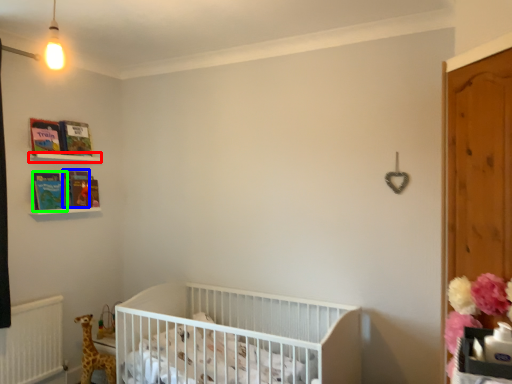
Question: Which object is the closest to the balustrade (highlighted by a red box)? Choose among these: magazine (highlighted by a blue box) or book (highlighted by a green box).

Choices:
 (A) magazine
 (B) book

Answer: (A)